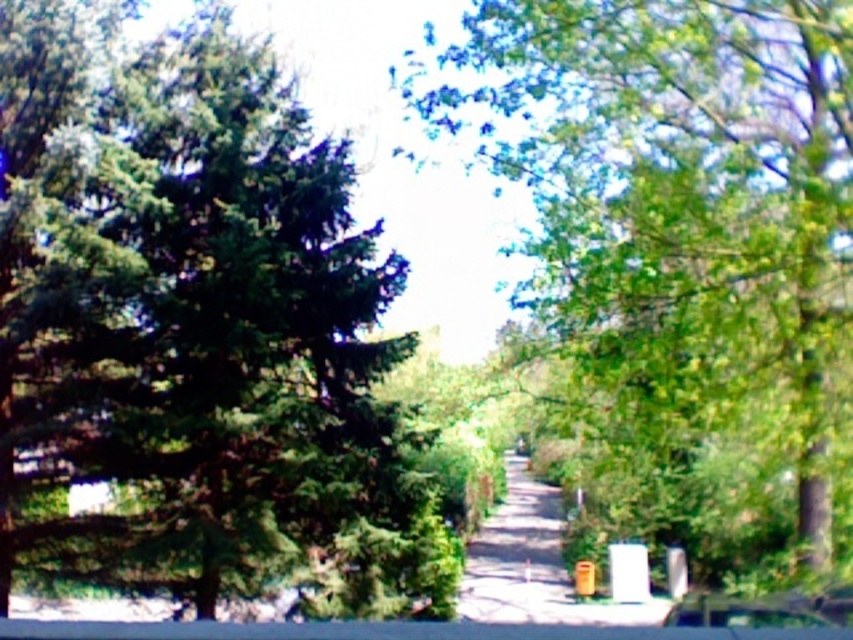
Is green leafy tree at center behind smooth concrete path at center?

That is False.

Which is below, green leafy tree at center or smooth concrete path at center?

smooth concrete path at center is lower down.

Measure the distance between point (x=566, y=268) and camera.

Point (x=566, y=268) and camera are 43.02 feet apart from each other.

You are a GUI agent. You are given a task and a screenshot of the screen. Output one action in this format:
    pyautogui.click(x=<x>, y=<y>)
    Task: Click on the green leafy tree at center
    This screenshot has width=853, height=640.
    Given the screenshot: What is the action you would take?
    pyautogui.click(x=688, y=244)

Does point (706, 509) lie in front of point (784, 600)?

No, it is behind (784, 600).

Which is behind, point (757, 40) or point (798, 625)?

The point (798, 625) is behind.

The image size is (853, 640). What do you see at coordinates (688, 244) in the screenshot?
I see `green leafy tree at center` at bounding box center [688, 244].

What are the coordinates of `green leafy tree at center` in the screenshot? It's located at (688, 244).

Who is more forward, (x=257, y=340) or (x=704, y=621)?

Point (x=257, y=340) is in front.

What do you see at coordinates (195, 330) in the screenshot?
I see `green leafy tree at left` at bounding box center [195, 330].

The image size is (853, 640). What are the coordinates of `green leafy tree at left` in the screenshot? It's located at (195, 330).